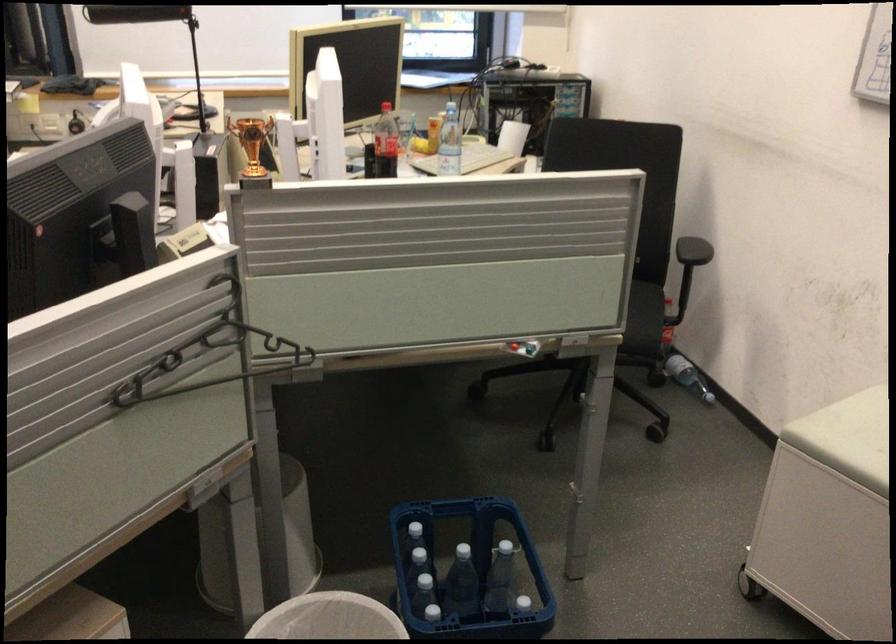
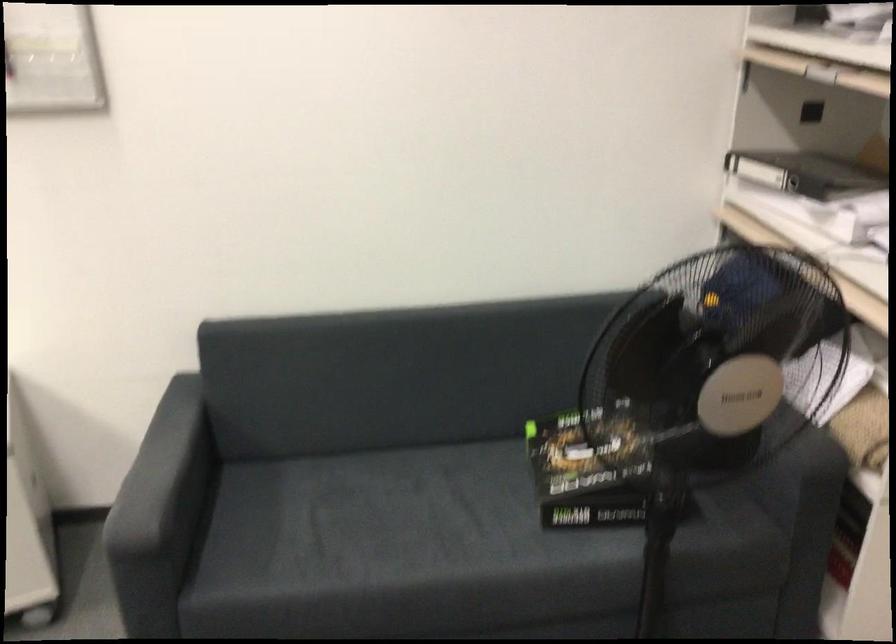
The images are taken continuously from a first-person perspective. In which direction is your viewpoint rotating?

The camera rotated toward right-down.